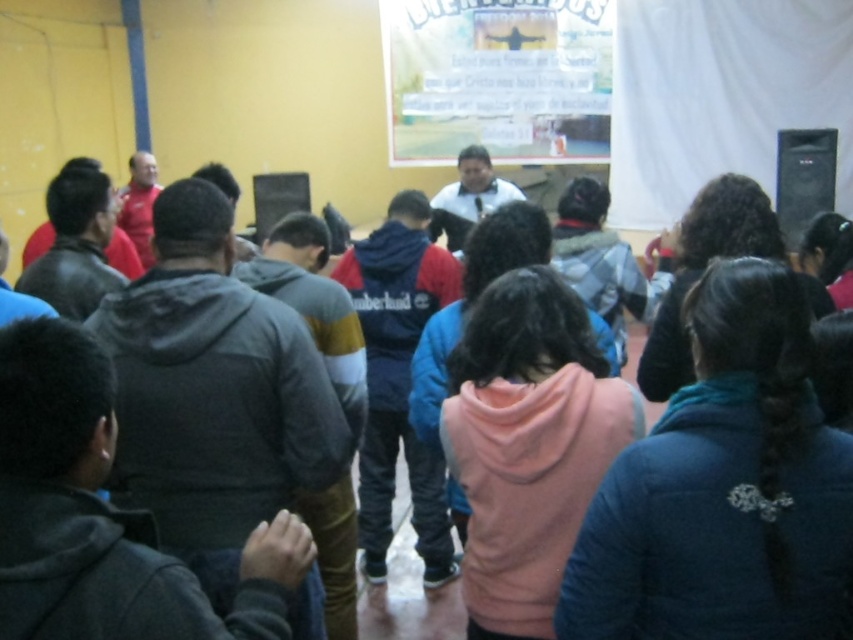
You are standing at the point marked as point (724, 486) in the image. What is the closest object to you?

The closest object to you at point (724, 486) is the blue fleece jacket at center.

From the picture: You are a photographer at the back of the room. You want to take a photo of the blue fleece jacket at center and the dark gray hoodie at center. Which one is closer to the camera?

The blue fleece jacket at center is below dark gray hoodie at center, so the dark gray hoodie at center is closer to the camera.